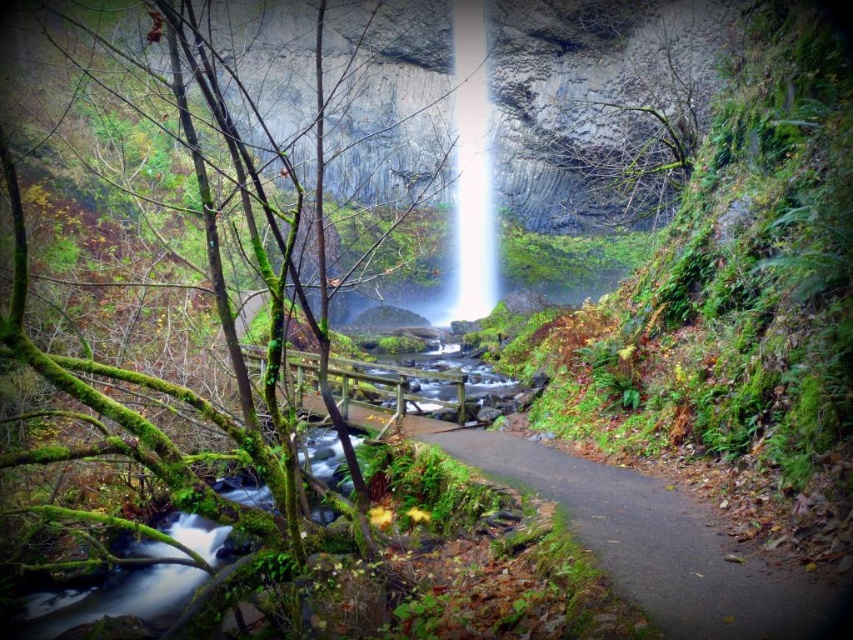
Can you confirm if green mossy tree at center is shorter than brown dirt path at center?

No, green mossy tree at center is not shorter than brown dirt path at center.

Is green mossy tree at center smaller than brown dirt path at center?

Actually, green mossy tree at center might be larger than brown dirt path at center.

Who is more forward, [190,400] or [601,557]?

Point [601,557] is more forward.

You are a GUI agent. You are given a task and a screenshot of the screen. Output one action in this format:
    pyautogui.click(x=<x>, y=<y>)
    Task: Click on the green mossy tree at center
    This screenshot has height=640, width=853.
    Given the screenshot: What is the action you would take?
    pyautogui.click(x=190, y=388)

Consider the image. Measure the distance between point (805, 627) and camera.

Point (805, 627) is 2.86 meters from camera.

Is brown dirt path at center above white translucent waterfall at center?

No.

The height and width of the screenshot is (640, 853). Describe the element at coordinates (659, 544) in the screenshot. I see `brown dirt path at center` at that location.

The width and height of the screenshot is (853, 640). I want to click on brown dirt path at center, so pyautogui.click(x=659, y=544).

Who is taller, green mossy tree at center or white translucent waterfall at center?

green mossy tree at center

Can you confirm if green mossy tree at center is positioned below white translucent waterfall at center?

Yes.

Where is `green mossy tree at center`? This screenshot has width=853, height=640. green mossy tree at center is located at coordinates (190, 388).

At what (x,y) coordinates should I click in order to perform the action: click on green mossy tree at center. Please return your answer as a coordinate pair (x, y). Looking at the image, I should click on (190, 388).